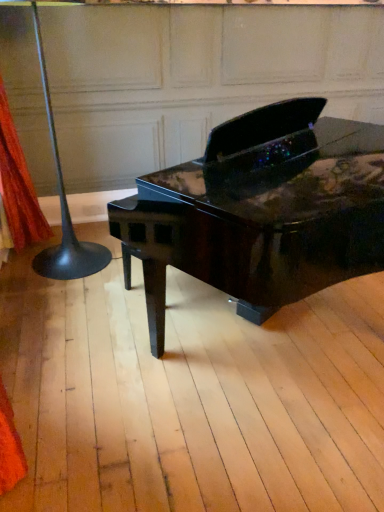
Measure the distance between orange fabric at left and camera.

They are 2.41 meters apart.

Find the location of a particular element. The width and height of the screenshot is (384, 512). black glossy floor lamp at left is located at coordinates (64, 208).

Is orange fabric at left facing away from black glossy floor lamp at left?

Correct, orange fabric at left is looking away from black glossy floor lamp at left.

In the scene shown: Between orange fabric at left and black glossy floor lamp at left, which one has larger size?

black glossy floor lamp at left.

Considering the positions of objects orange fabric at left and black glossy floor lamp at left in the image provided, who is more to the left, orange fabric at left or black glossy floor lamp at left?

orange fabric at left.

Does orange fabric at left have a greater width compared to black glossy floor lamp at left?

Incorrect, the width of orange fabric at left does not surpass that of black glossy floor lamp at left.

From the picture: Is black glossy floor lamp at left to the left of orange fabric at left from the viewer's perspective?

Incorrect, black glossy floor lamp at left is not on the left side of orange fabric at left.

Can you confirm if black glossy floor lamp at left is wider than orange fabric at left?

Indeed, black glossy floor lamp at left has a greater width compared to orange fabric at left.

Does black glossy floor lamp at left come in front of orange fabric at left?

Yes, the depth of black glossy floor lamp at left is less than that of orange fabric at left.

Which is in front, point (71, 275) or point (17, 190)?

The point (71, 275) is closer.

Between black glossy floor lamp at left and glossy black piano at center, which one has larger size?

glossy black piano at center.

Would you say black glossy floor lamp at left is to the left or to the right of glossy black piano at center in the picture?

black glossy floor lamp at left is positioned on glossy black piano at center's left side.

Is glossy black piano at center situated inside black glossy floor lamp at left or outside?

glossy black piano at center is spatially situated outside black glossy floor lamp at left.

Which of these two, glossy black piano at center or black glossy floor lamp at left, is wider?

glossy black piano at center.

Which object is more forward, glossy black piano at center or black glossy floor lamp at left?

glossy black piano at center is more forward.

Does glossy black piano at center have a greater height compared to orange fabric at left?

Incorrect, the height of glossy black piano at center is not larger of that of orange fabric at left.

Considering the sizes of objects glossy black piano at center and orange fabric at left in the image provided, who is smaller, glossy black piano at center or orange fabric at left?

orange fabric at left.

Relative to orange fabric at left, is glossy black piano at center in front or behind?

glossy black piano at center is positioned closer to the viewer than orange fabric at left.

What are the coordinates of `curtain behind the glossy black piano at center` in the screenshot? It's located at (18, 185).

Is orange fabric at left further to the viewer compared to glossy black piano at center?

Yes, the depth of orange fabric at left is greater than that of glossy black piano at center.

Does orange fabric at left touch glossy black piano at center?

No, orange fabric at left is not with glossy black piano at center.

From a real-world perspective, which is physically above, orange fabric at left or glossy black piano at center?

In real-world perspective, orange fabric at left is above.

Would you say orange fabric at left is outside glossy black piano at center?

Absolutely, orange fabric at left is external to glossy black piano at center.

In order to click on curtain that appears above the black glossy floor lamp at left (from the image's perspective) in this screenshot , I will do `click(18, 185)`.

Locate an element on the screen. table lamp in front of the orange fabric at left is located at coordinates (64, 208).

When comparing their distances from black glossy floor lamp at left, does glossy black piano at center or orange fabric at left seem closer?

orange fabric at left.

When comparing their distances from glossy black piano at center, does orange fabric at left or black glossy floor lamp at left seem further?

orange fabric at left lies further to glossy black piano at center than the other object.

When comparing their distances from orange fabric at left, does black glossy floor lamp at left or glossy black piano at center seem closer?

The object closer to orange fabric at left is black glossy floor lamp at left.

Based on their spatial positions, is black glossy floor lamp at left or orange fabric at left closer to glossy black piano at center?

black glossy floor lamp at left is closer to glossy black piano at center.

Looking at the image, which one is located further to orange fabric at left, glossy black piano at center or black glossy floor lamp at left?

glossy black piano at center lies further to orange fabric at left than the other object.

From the image, which object appears to be farther from black glossy floor lamp at left, orange fabric at left or glossy black piano at center?

glossy black piano at center lies further to black glossy floor lamp at left than the other object.

At what (x,y) coordinates should I click in order to perform the action: click on table lamp between orange fabric at left and glossy black piano at center in the horizontal direction. Please return your answer as a coordinate pair (x, y). Looking at the image, I should click on (64, 208).